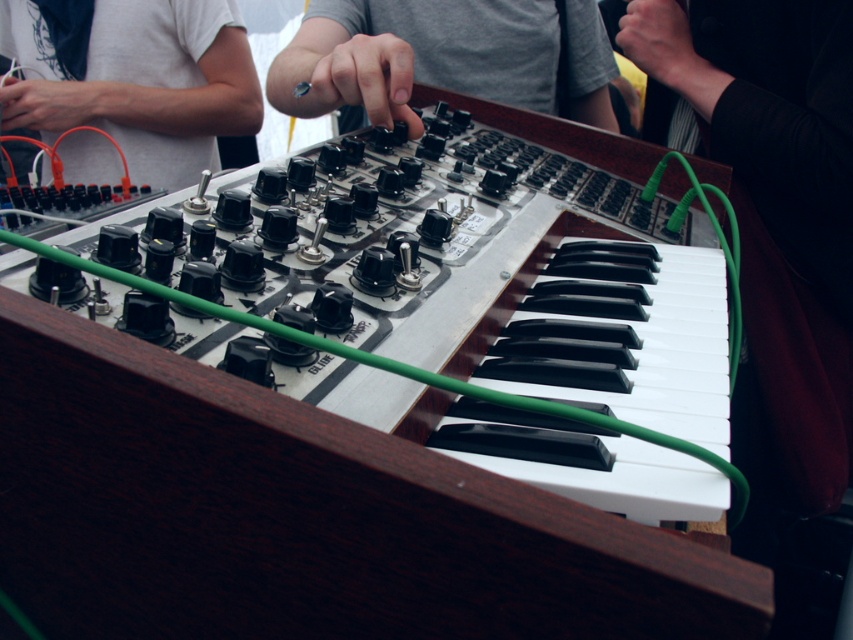
You are setting up a synthesizer and need to place a white matte shirt at upper left and a gray matte switch at center on the panel. Considering their sizes, which object will occupy more space horizontally?

The gray matte switch at center has a greater width than the white matte shirt at upper left, so it will occupy more horizontal space.

You are a sound engineer setting up the synthesizer. You notice a point at coordinates point [132,77] on the synthesizer panel. What object is located at that position?

The point [132,77] corresponds to the white matte shirt at upper left.

You are adjusting the synthesizer and need to reach both the point at position (224, 132) and the point at position (467, 28). Which point should you reach first to minimize the distance traveled?

You should reach the point at position (224, 132) first because it is closer to you than the point at position (467, 28).